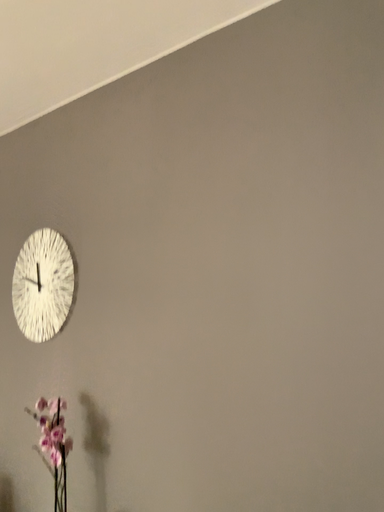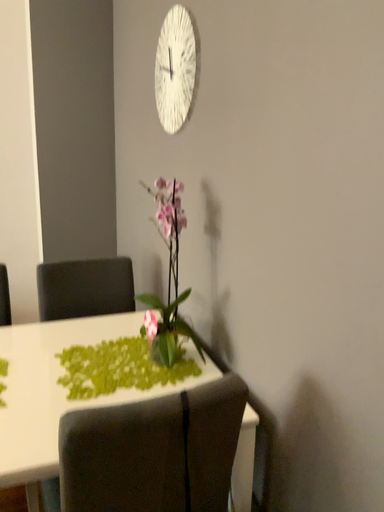
Question: How did the camera likely rotate when shooting the video?

Choices:
 (A) rotated right
 (B) rotated left

Answer: (B)